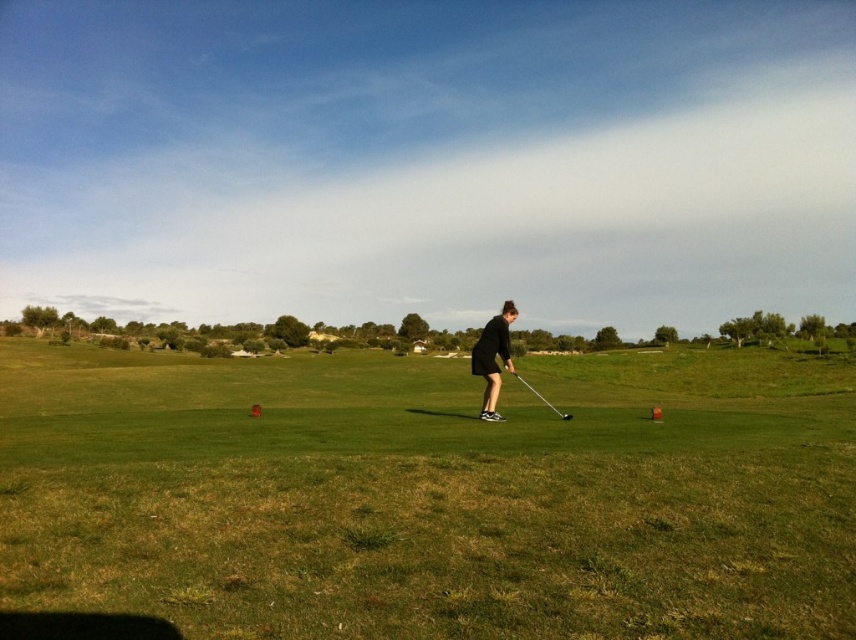
You are a golfer standing on the green grass at center. You want to hit a golf ball to the hole located at point (429, 497). Is the hole directly in front of you or to the side?

The point (429, 497) indicates green grass at center, so the hole is directly in front of you.

You are standing on the golf course and see two points marked on the ground. The first point is at coordinates point [509,310] and the second is at point [539,394]. Which point is closer to you?

Point [509,310] is closer to the viewer than point [539,394].

You are a golfer planning to place a new golf ball on the green grass at center. Considering the width of the metallic silver golf club at center, can you estimate if the grass area is wider than the golf club?

The green grass at center is wider than the metallic silver golf club at center, so the grass area is indeed wider than the golf club.